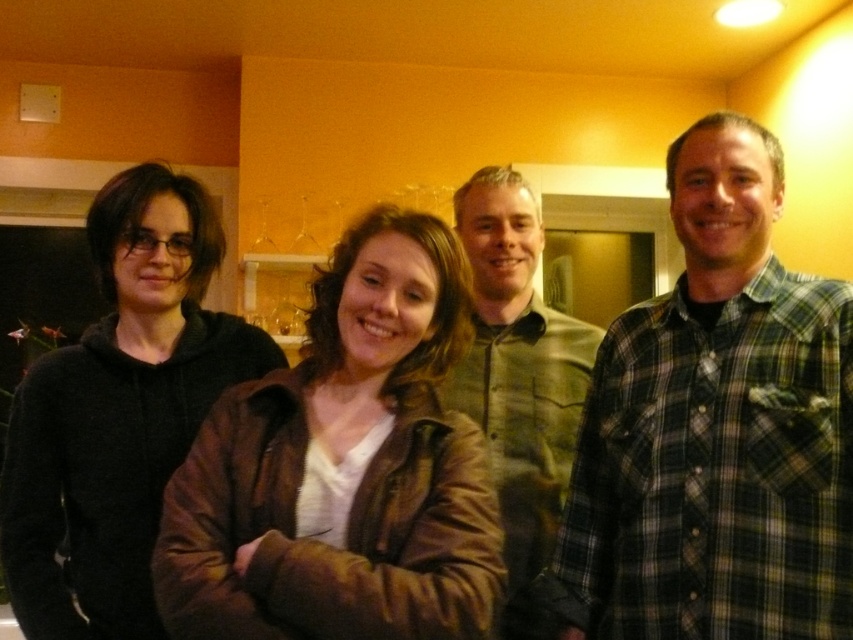
You are organizing a clothing donation drive and need to determine which of the two items at the center of the image can fit into a standard medium donation bag. The brown leather jacket at center and the green plaid shirt at center are both candidates. Based on their sizes, which item is more likely to fit into the bag?

The brown leather jacket at center has a smaller size compared to the green plaid shirt at center, so it is more likely to fit into a standard medium donation bag.

You are trying to find the plaid flannel shirt at right and the green plaid shirt at center in the image. Which one is located to the right of the other?

The plaid flannel shirt at right is positioned on the right side of green plaid shirt at center.